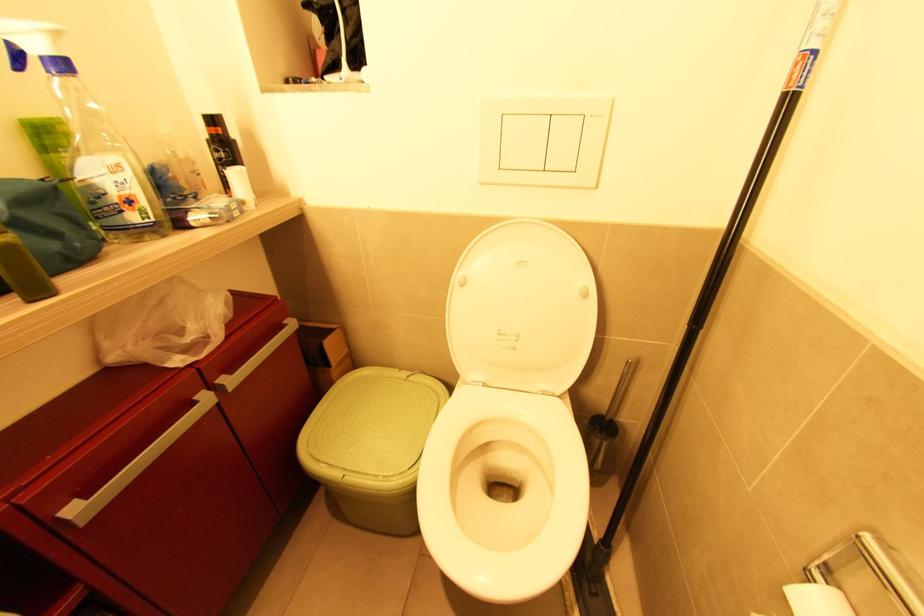
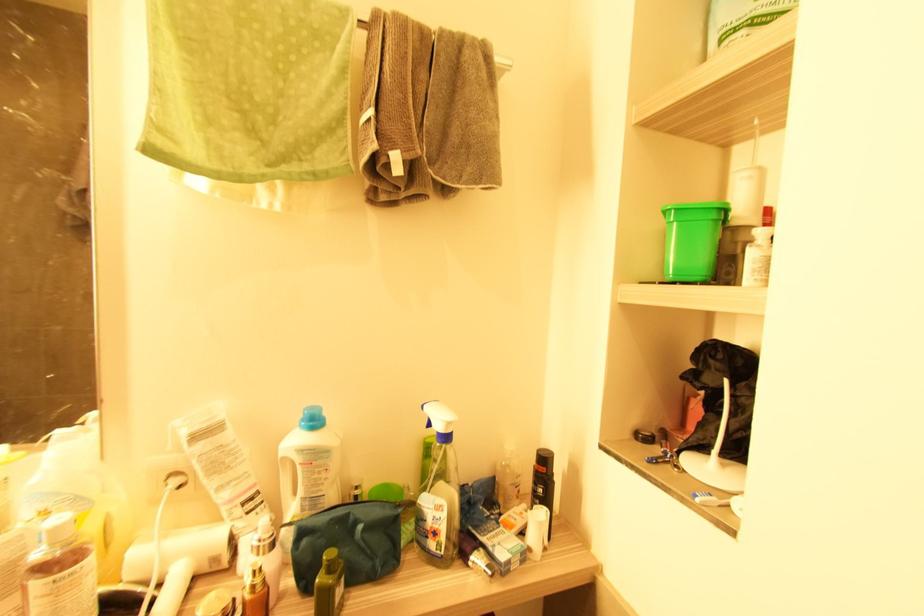
Where in the second image is the point corresponding to (222,131) from the first image?

(545, 469)